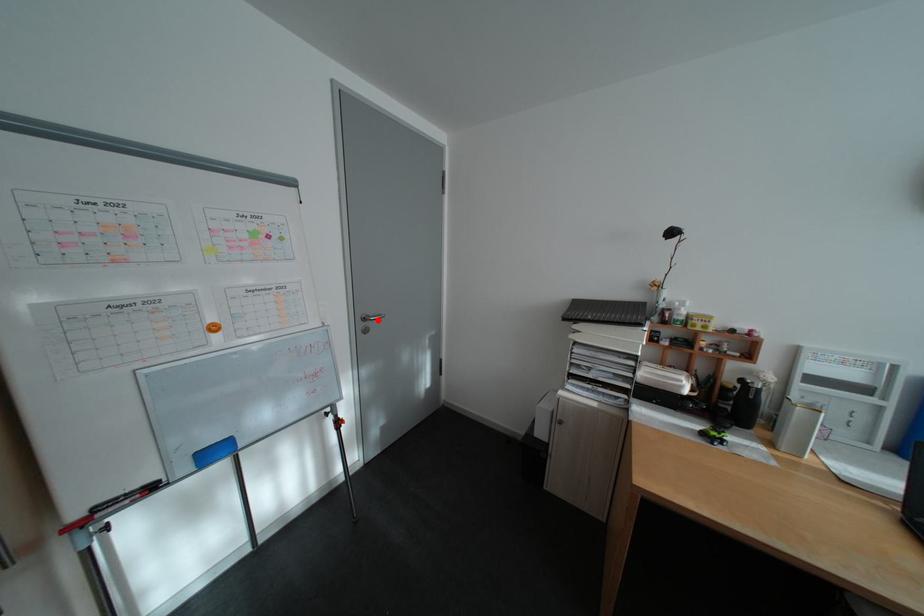
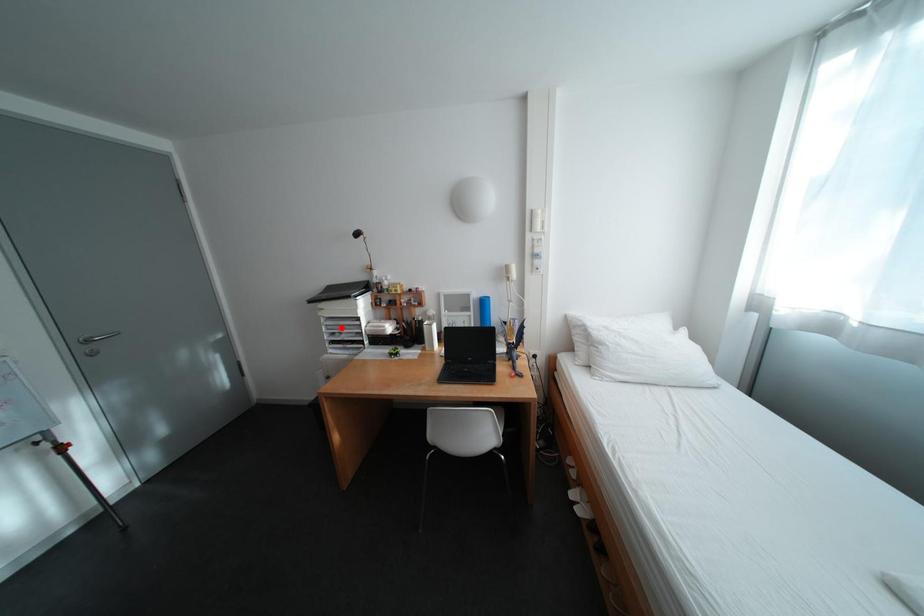
I am providing you with two images of the same scene from different viewpoints. A red point is marked on the first image and another point is marked on the second image. Is the marked point in image1 the same physical position as the marked point in image2?

No